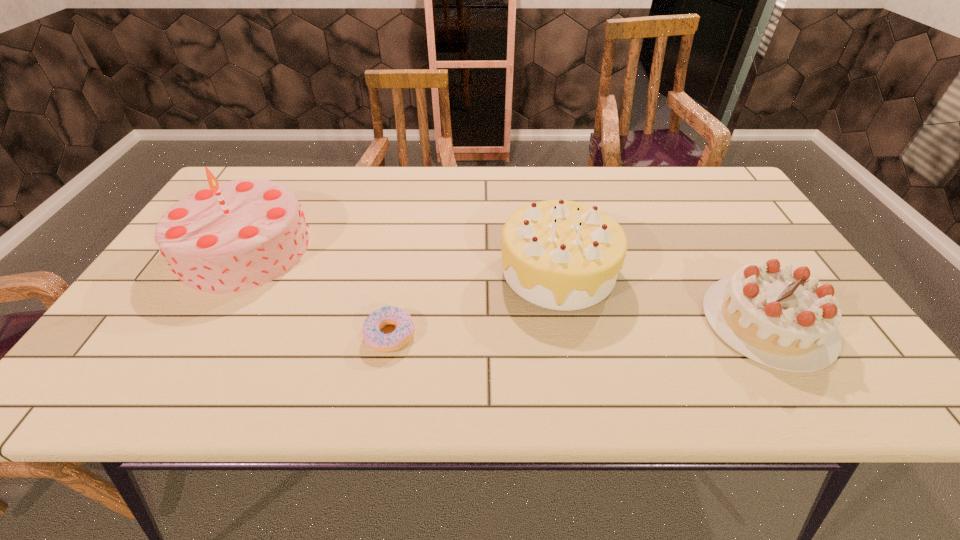
Locate an element on the screen. This screenshot has height=540, width=960. vacant region at the far right corner of the desktop is located at coordinates (725, 176).

Locate an element on the screen. The image size is (960, 540). vacant point located between the second object from left to right and the tallest object is located at coordinates (318, 292).

This screenshot has width=960, height=540. I want to click on free space between the second tallest birthday cake and the shortest object, so click(x=474, y=302).

I want to click on vacant area between the second birthday cake from right to left and the doughnut, so click(x=474, y=302).

Where is `empty location between the second shortest birthday cake and the shortest object`? Image resolution: width=960 pixels, height=540 pixels. empty location between the second shortest birthday cake and the shortest object is located at coordinates (474, 302).

The height and width of the screenshot is (540, 960). What are the coordinates of `free space between the tallest birthday cake and the second object from right to left` in the screenshot? It's located at (401, 259).

The width and height of the screenshot is (960, 540). I want to click on blank region between the tallest birthday cake and the shortest birthday cake, so click(506, 285).

This screenshot has height=540, width=960. In order to click on free space between the second shortest object and the third shortest object in this screenshot , I will do `click(663, 296)`.

Where is `free space that is in between the second birthday cake from left to right and the doughnut`? The height and width of the screenshot is (540, 960). free space that is in between the second birthday cake from left to right and the doughnut is located at coordinates (x=474, y=302).

You are a GUI agent. You are given a task and a screenshot of the screen. Output one action in this format:
    pyautogui.click(x=<x>, y=<y>)
    Task: Click on the unoccupied area between the tallest birthday cake and the rightmost object
    
    Given the screenshot: What is the action you would take?
    pyautogui.click(x=506, y=285)